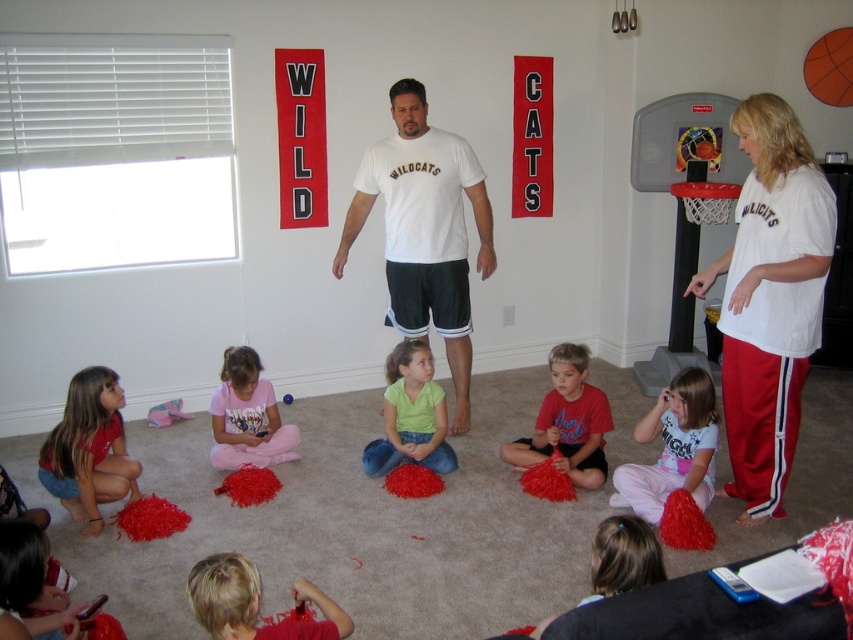
Question: Is green matte shirt at center thinner than orange matte basketball at upper right?

Choices:
 (A) yes
 (B) no

Answer: (B)

Question: Which of these objects is positioned closest to the pink cotton shirt at center?

Choices:
 (A) orange matte basketball at upper right
 (B) pink fabric at center
 (C) matte red pom-pom at lower left

Answer: (B)

Question: Is white matte t-shirt at center smaller than pink cotton shirt at center?

Choices:
 (A) no
 (B) yes

Answer: (A)

Question: Is white matte t-shirt at center further to camera compared to smooth red pom-pom at lower left?

Choices:
 (A) no
 (B) yes

Answer: (B)

Question: Which is farther from the metallic gray basketball hoop at right?

Choices:
 (A) pink fabric at center
 (B) red matte pom-pom at center

Answer: (A)

Question: Which point is farther to the camera?

Choices:
 (A) (415, 145)
 (B) (190, 598)
 (C) (231, 468)

Answer: (A)